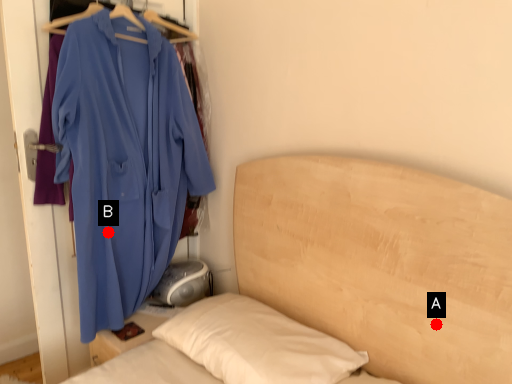
Question: Two points are circled on the image, labeled by A and B beside each circle. Which of the following is the closest to the observer?

Choices:
 (A) A is closer
 (B) B is closer

Answer: (A)